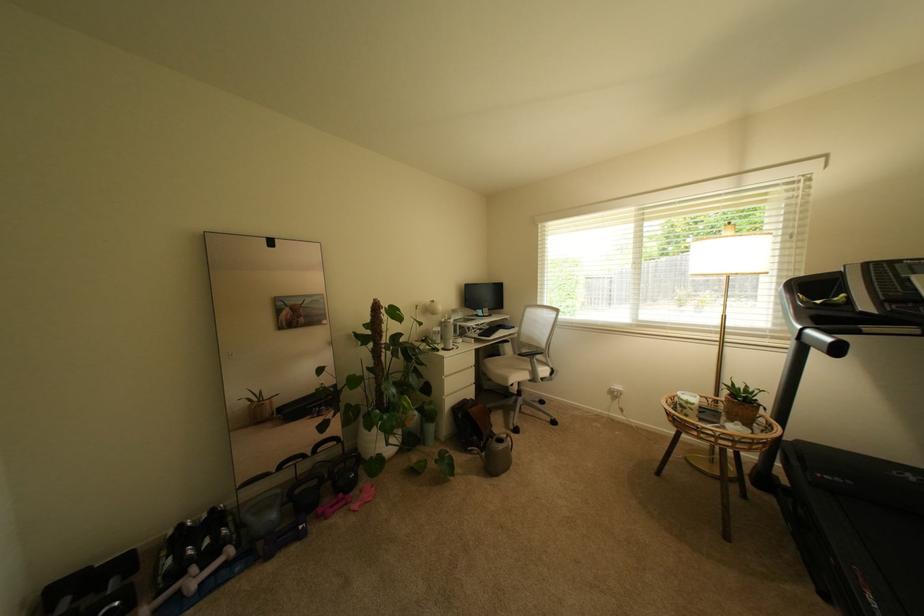
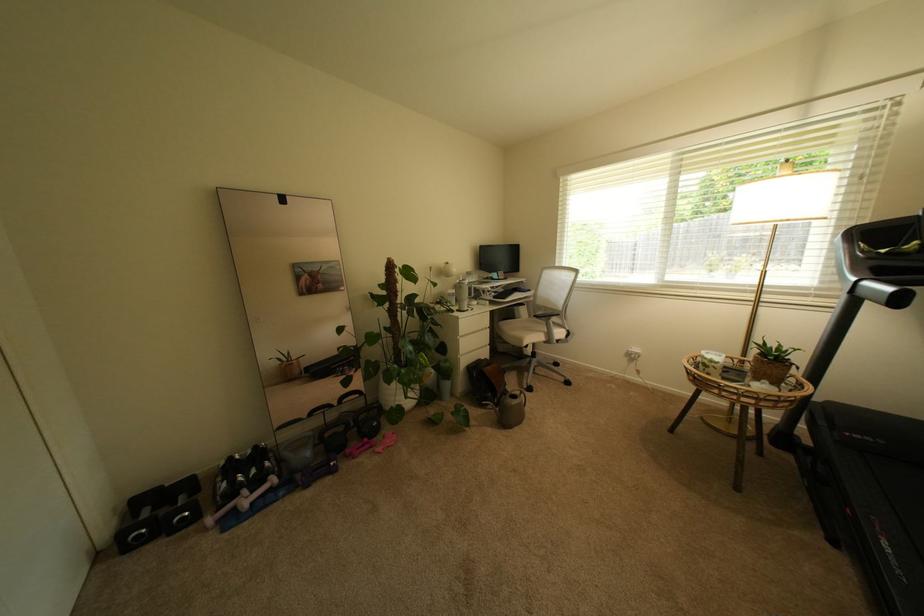
Question: The first image is from the beginning of the video and the second image is from the end. How did the camera likely rotate when shooting the video?

Choices:
 (A) Left
 (B) Right
 (C) Up
 (D) Down

Answer: (D)